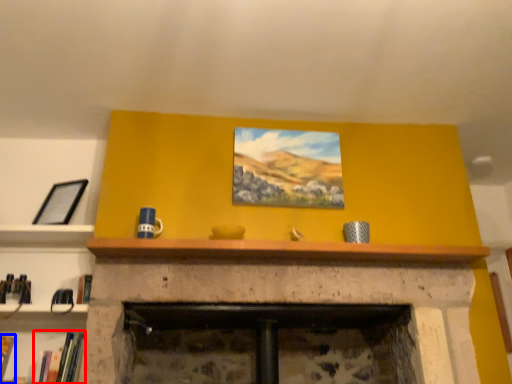
Question: Which object appears farthest to the camera in this image, book (highlighted by a red box) or book (highlighted by a blue box)?

Choices:
 (A) book
 (B) book

Answer: (B)